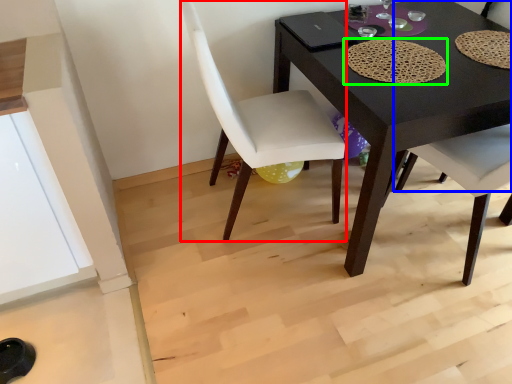
Question: Which object is positioned closest to chair (highlighted by a red box)? Select from chair (highlighted by a blue box) and mat (highlighted by a green box).

Choices:
 (A) chair
 (B) mat

Answer: (B)